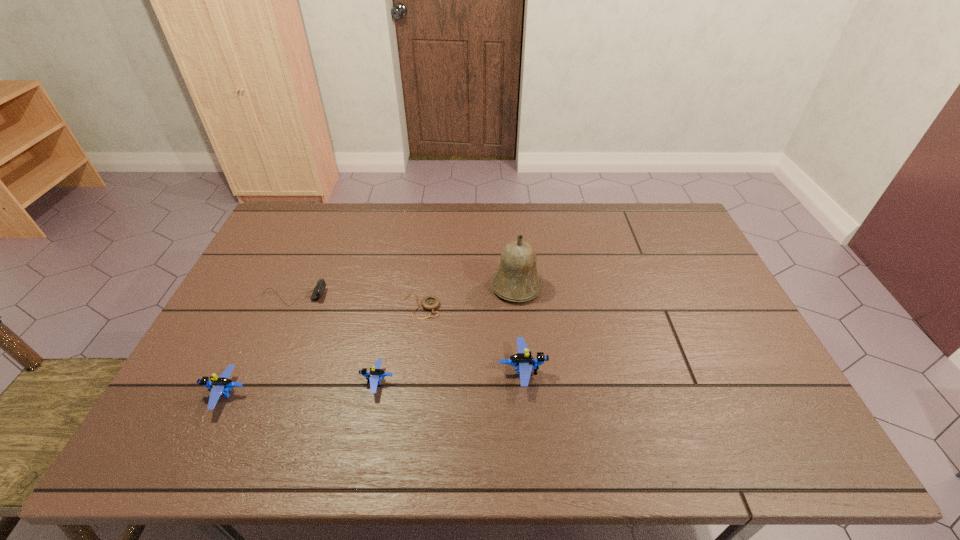
Locate an element on the screen. This screenshot has width=960, height=540. vacant space located on the front-facing side of the second Lego from left to right is located at coordinates (238, 382).

Locate an element on the screen. blank area located on the front-facing side of the second Lego from left to right is located at coordinates (247, 382).

This screenshot has width=960, height=540. Find the location of `vacant space located on the front-facing side of the second Lego from left to right`. vacant space located on the front-facing side of the second Lego from left to right is located at coordinates (271, 382).

Identify the location of free location located on the front-facing side of the tallest Lego. This screenshot has height=540, width=960. (670, 370).

This screenshot has width=960, height=540. In order to click on vacant space located on the front-facing side of the fifth tallest object in this screenshot , I will do `click(451, 297)`.

I want to click on free location located 0.340m on the front of the tallest object, so click(x=527, y=408).

Find the location of `free spot located 0.150m on the left of the pocket watch`. free spot located 0.150m on the left of the pocket watch is located at coordinates (351, 306).

Locate an element on the screen. Image resolution: width=960 pixels, height=540 pixels. Lego present at the left edge is located at coordinates (219, 386).

The image size is (960, 540). I want to click on webcam located in the left edge section of the desktop, so click(x=318, y=291).

Where is `object at the near left corner`? The width and height of the screenshot is (960, 540). object at the near left corner is located at coordinates (219, 386).